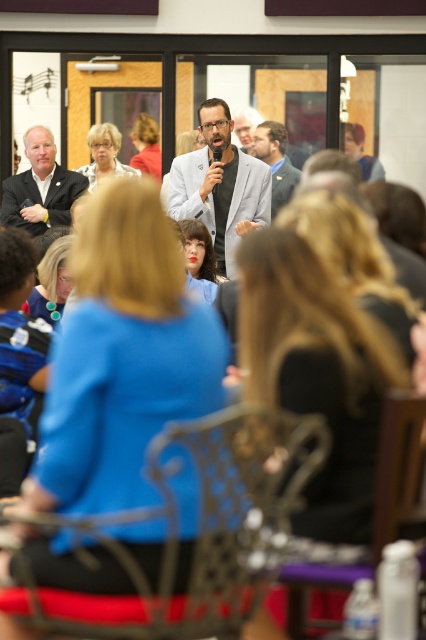
Question: Which point appears closest to the camera in this image?

Choices:
 (A) (379, 451)
 (B) (63, 602)

Answer: (B)

Question: Does matte gray blazer at center appear on the right side of blonde hair at upper left?

Choices:
 (A) no
 (B) yes

Answer: (B)

Question: Which of the following is the farthest from the observer?

Choices:
 (A) matte blue shirt at lower center
 (B) matte black jacket at upper right

Answer: (B)

Question: Does matte gray blazer at center have a lesser width compared to matte black jacket at upper right?

Choices:
 (A) yes
 (B) no

Answer: (B)

Question: Does matte black jacket at upper left have a larger size compared to matte black jacket at upper right?

Choices:
 (A) yes
 (B) no

Answer: (A)

Question: Which point is closer to the camera?

Choices:
 (A) (345, 134)
 (B) (221, 113)
 (C) (256, 152)

Answer: (B)